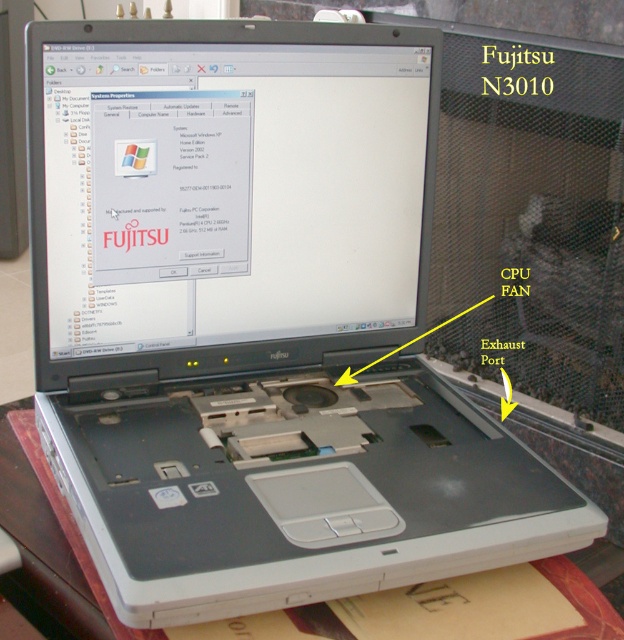
Measure the distance from matte black screen at center to white plastic table at lower center.

matte black screen at center is 34.37 centimeters from white plastic table at lower center.

Is matte black screen at center further to the viewer compared to white plastic table at lower center?

That is True.

This screenshot has width=624, height=640. I want to click on matte black screen at center, so click(230, 189).

At what (x,y) coordinates should I click in order to perform the action: click on matte black screen at center. Please return your answer as a coordinate pair (x, y). Image resolution: width=624 pixels, height=640 pixels. Looking at the image, I should click on (230, 189).